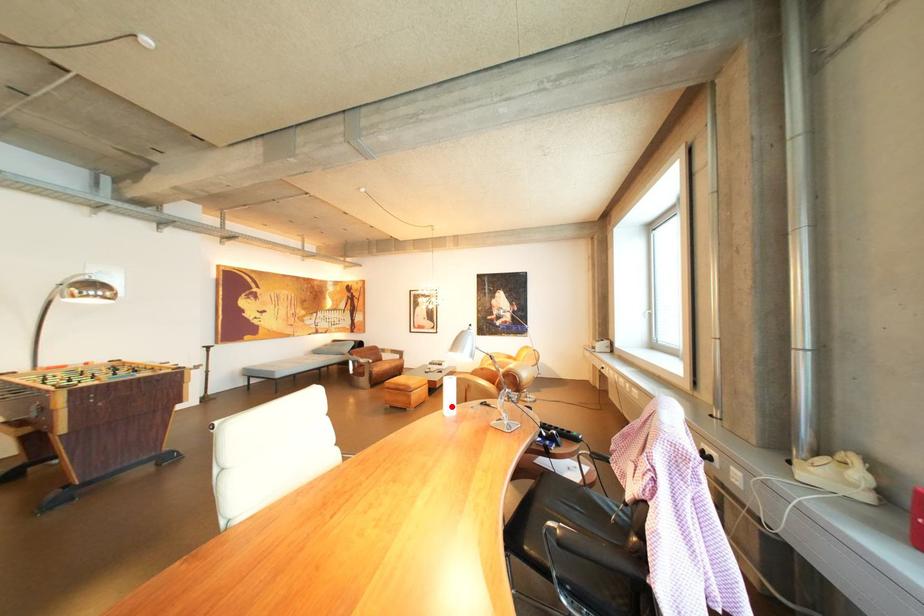
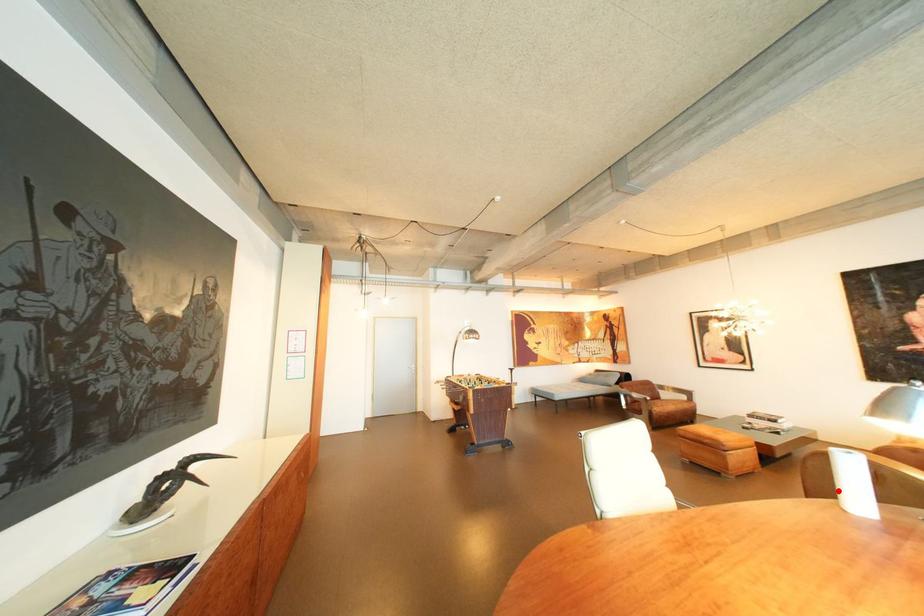
I am providing you with two images of the same scene from different viewpoints. A red point is marked on the first image and another point is marked on the second image. Are the points marked in image1 and image2 representing the same 3D position?

Yes